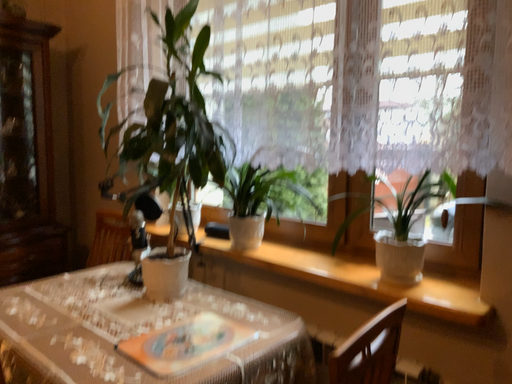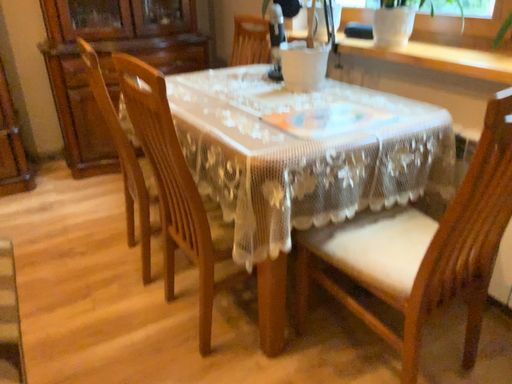
Question: Which way did the camera rotate in the video?

Choices:
 (A) rotated downward
 (B) rotated upward

Answer: (A)